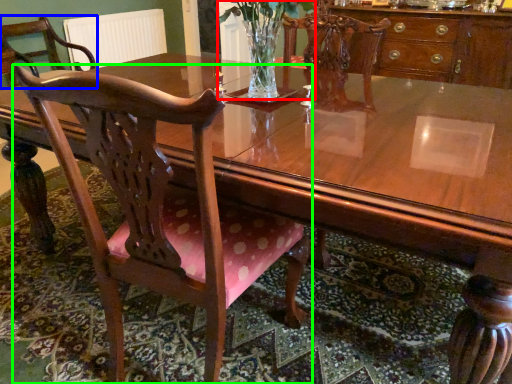
Question: Considering the real-world distances, which object is farthest from floral arrangement (highlighted by a red box)? chair (highlighted by a blue box) or chair (highlighted by a green box)?

Choices:
 (A) chair
 (B) chair

Answer: (A)